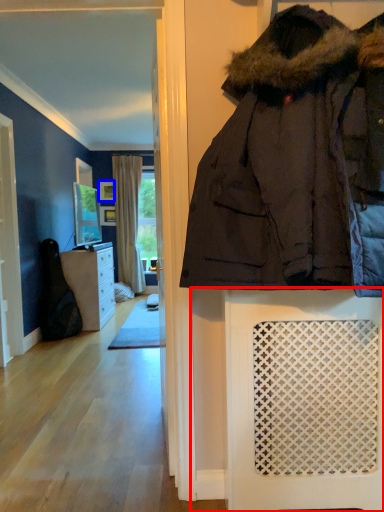
Question: Which object appears farthest to the camera in this image, furniture (highlighted by a red box) or picture frame (highlighted by a blue box)?

Choices:
 (A) furniture
 (B) picture frame

Answer: (B)